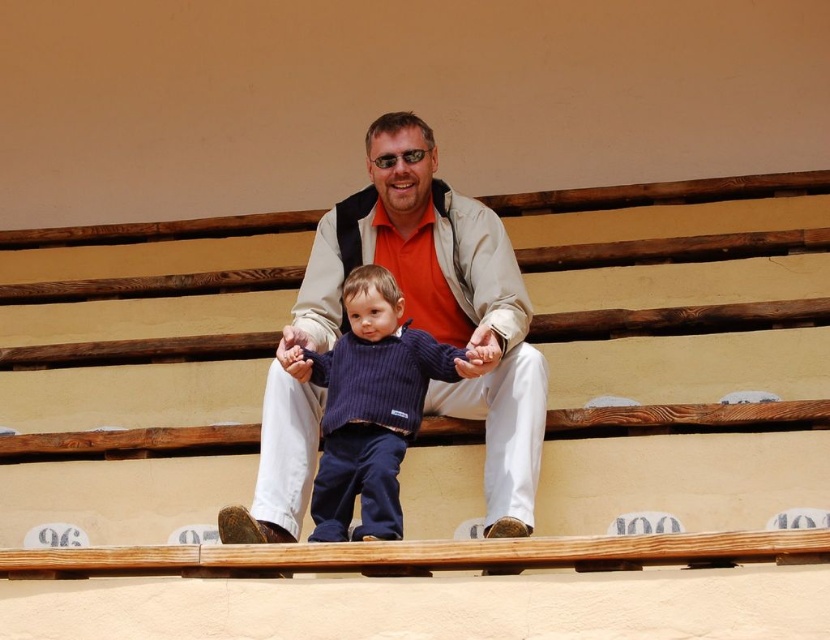
You are designing a new bench for a park and want to ensure it can accommodate both the wooden at center and the matte beige jacket at center. Based on the image, which object is wider?

The wooden at center is wider than the matte beige jacket at center according to the description.

You are a tailor who needs to determine which clothing item requires more fabric to make between the matte beige jacket at center and the dark blue ribbed sweater at center. Based on the image, which one would need more fabric?

The matte beige jacket at center has a larger size compared to dark blue ribbed sweater at center, so it would require more fabric to make.